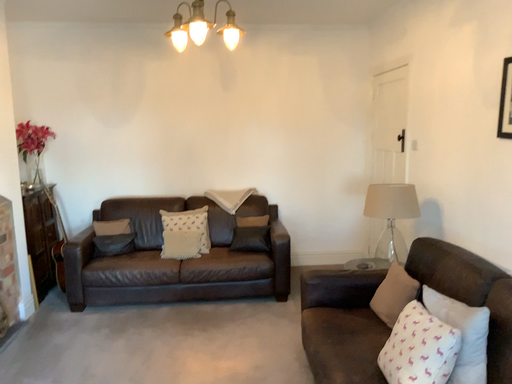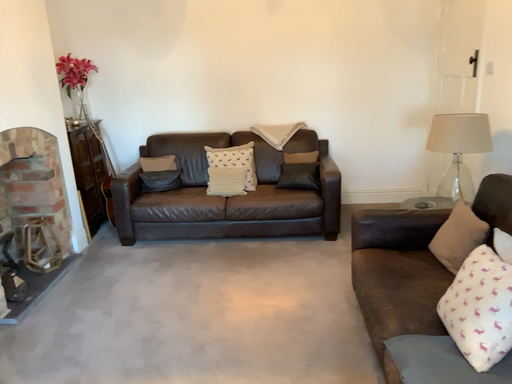
Question: How did the camera likely rotate when shooting the video?

Choices:
 (A) rotated downward
 (B) rotated upward

Answer: (A)